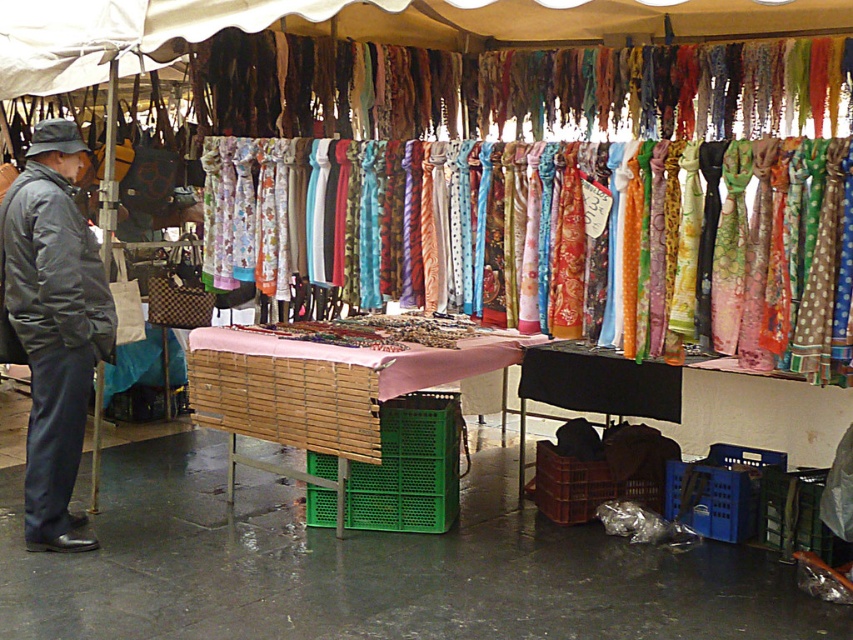
From the picture: Can you confirm if wooden crate at center is wider than floral silk scarf at center?

Yes.

Is wooden crate at center further to the viewer compared to floral silk scarf at center?

That is True.

Where is `wooden crate at center`? wooden crate at center is located at coordinates (318, 392).

Can you confirm if wooden crate at center is smaller than dark gray puffy jacket at left?

No, wooden crate at center is not smaller than dark gray puffy jacket at left.

Measure the distance between wooden crate at center and camera.

They are 4.67 meters apart.

Is point (299, 364) less distant than point (48, 268)?

No, it is behind (48, 268).

Identify the location of wooden crate at center. tap(318, 392).

Does point (53, 284) lie behind point (300, 426)?

That is False.

Between dark gray fabric jacket at left and wooden crate at center, which one appears on the left side from the viewer's perspective?

dark gray fabric jacket at left is more to the left.

Locate an element on the screen. Image resolution: width=853 pixels, height=640 pixels. dark gray fabric jacket at left is located at coordinates (51, 324).

Where is `dark gray fabric jacket at left`? dark gray fabric jacket at left is located at coordinates (51, 324).